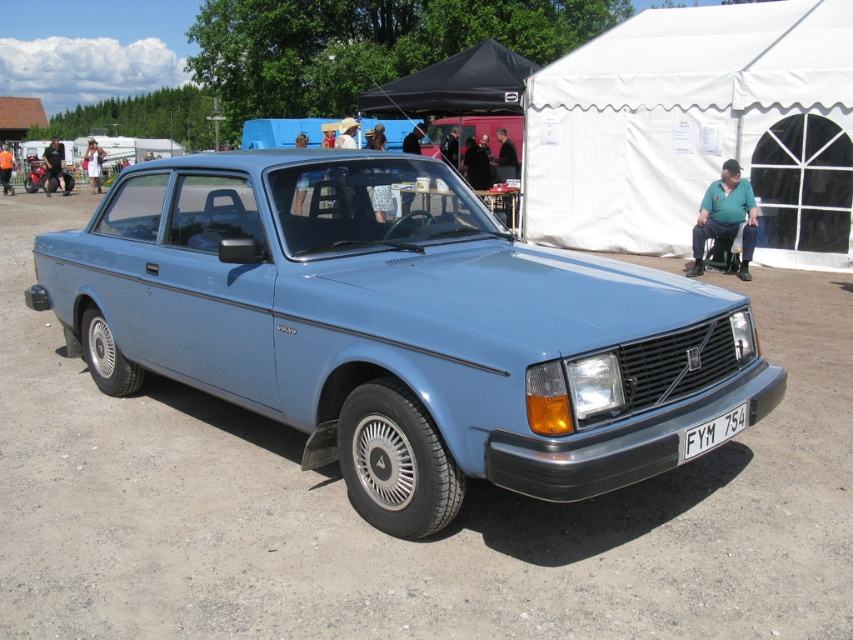
From the picture: Can you confirm if light blue metallic car at center is shorter than white fabric tent at upper right?

Yes, light blue metallic car at center is shorter than white fabric tent at upper right.

Between light blue metallic car at center and white fabric tent at upper right, which one is positioned higher?

white fabric tent at upper right is above.

At what (x,y) coordinates should I click in order to perform the action: click on light blue metallic car at center. Please return your answer as a coordinate pair (x, y). The width and height of the screenshot is (853, 640). Looking at the image, I should click on (396, 326).

Who is shorter, white fabric tent at upper right or white plastic license plate at front?

With less height is white plastic license plate at front.

Can you confirm if white fabric tent at upper right is bigger than white plastic license plate at front?

Yes, white fabric tent at upper right is bigger than white plastic license plate at front.

The height and width of the screenshot is (640, 853). What do you see at coordinates (697, 131) in the screenshot? I see `white fabric tent at upper right` at bounding box center [697, 131].

Where is `white fabric tent at upper right`? The image size is (853, 640). white fabric tent at upper right is located at coordinates (697, 131).

Which is above, white fabric tent at upper right or light blue matte car at center?

Positioned higher is white fabric tent at upper right.

Find the location of `white fabric tent at upper right`. white fabric tent at upper right is located at coordinates (697, 131).